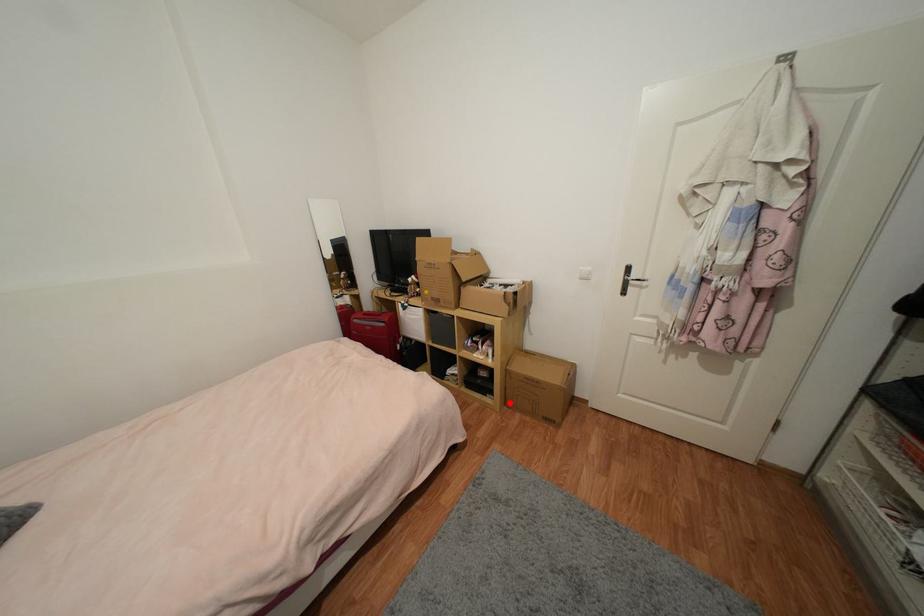
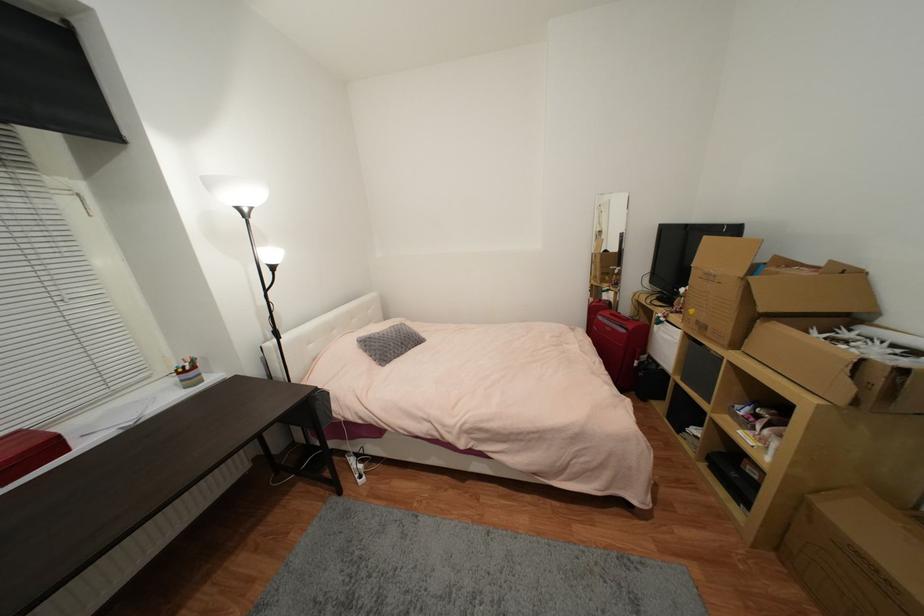
Question: I am providing you with two images of the same scene from different viewpoints. Image1 has a red point marked. In image2, the corresponding 3D location appears at what relative position? Reply with the corresponding letter.

Choices:
 (A) Closer
 (B) Farther

Answer: (B)